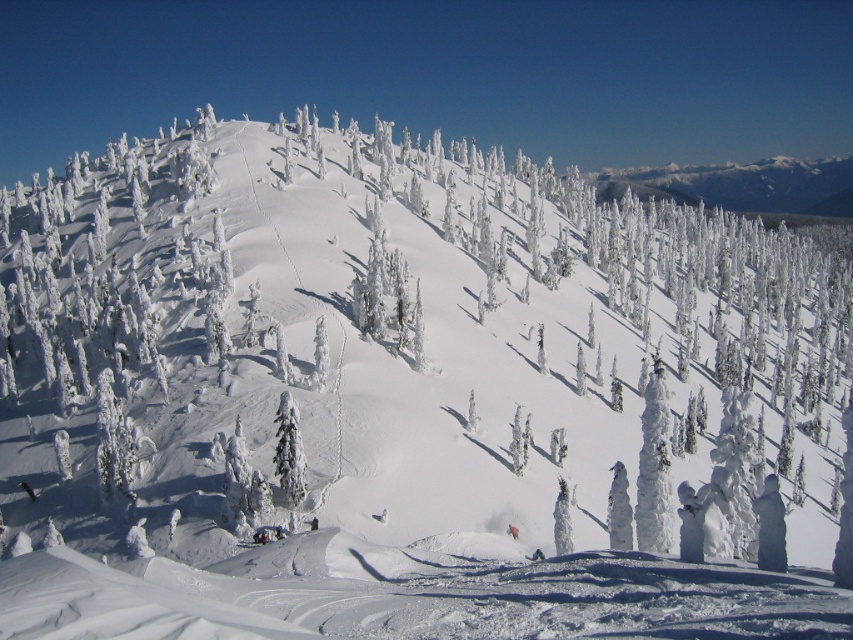
Question: Is white frosty tree at center-right bigger than white frosty tree at center?

Choices:
 (A) no
 (B) yes

Answer: (B)

Question: Which object appears closest to the camera in this image?

Choices:
 (A) white frosty tree at center
 (B) white frosty tree at center-right

Answer: (B)

Question: Among these objects, which one is nearest to the camera?

Choices:
 (A) white frosty tree at center
 (B) white frosty tree at center-right

Answer: (B)

Question: Which of the following is the closest to the observer?

Choices:
 (A) (648, 513)
 (B) (566, 532)

Answer: (A)

Question: Can you confirm if white frosty tree at center-right is bigger than white frosty tree at center?

Choices:
 (A) no
 (B) yes

Answer: (B)

Question: Does white frosty tree at center-right appear on the left side of white frosty tree at center?

Choices:
 (A) yes
 (B) no

Answer: (B)